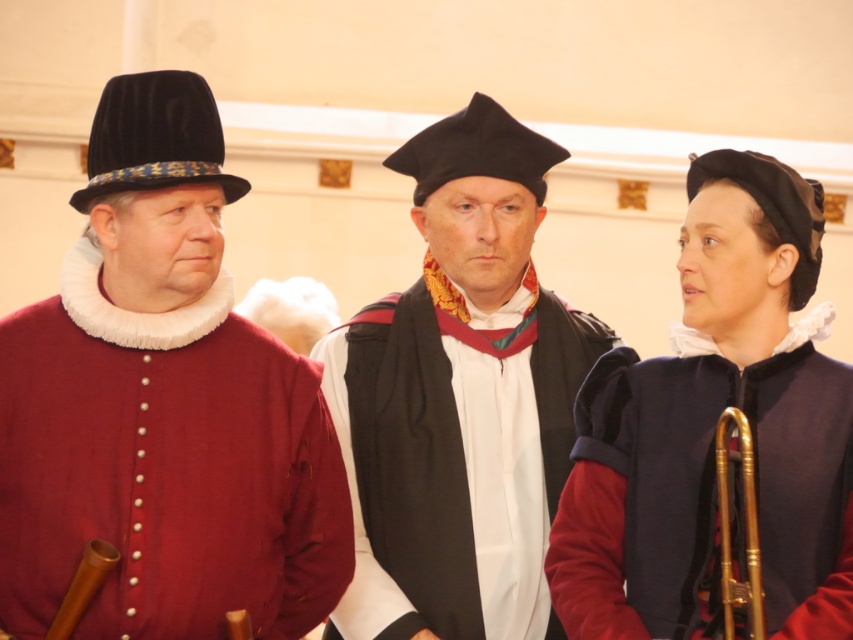
Is velvet black beret at right taller than wooden flute at left?

Yes.

Is point (825, 400) less distant than point (102, 547)?

That is False.

Does point (718, 204) lie in front of point (83, 564)?

No, it is behind (83, 564).

The image size is (853, 640). I want to click on velvet black beret at right, so click(x=712, y=429).

Who is more distant from viewer, (x=161, y=256) or (x=721, y=557)?

Point (x=161, y=256)

Which of these two, matte red coat at left or gold brass trumpet at lower right, stands taller?

matte red coat at left is taller.

Is point (128, 252) less distant than point (732, 589)?

No, (128, 252) is behind (732, 589).

Identify the location of matte red coat at left. (161, 406).

This screenshot has width=853, height=640. What do you see at coordinates (460, 397) in the screenshot?
I see `matte black gown at center` at bounding box center [460, 397].

Which of these two, matte black gown at center or wooden flute at left, stands shorter?

wooden flute at left

This screenshot has height=640, width=853. In order to click on matte black gown at center in this screenshot , I will do `click(460, 397)`.

Where is `matte black gown at center`? The height and width of the screenshot is (640, 853). matte black gown at center is located at coordinates (460, 397).